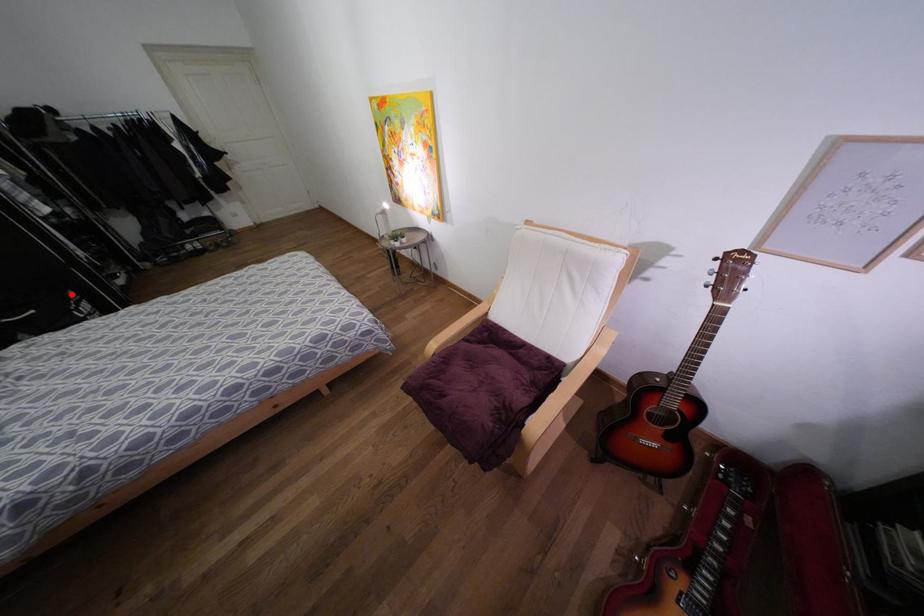
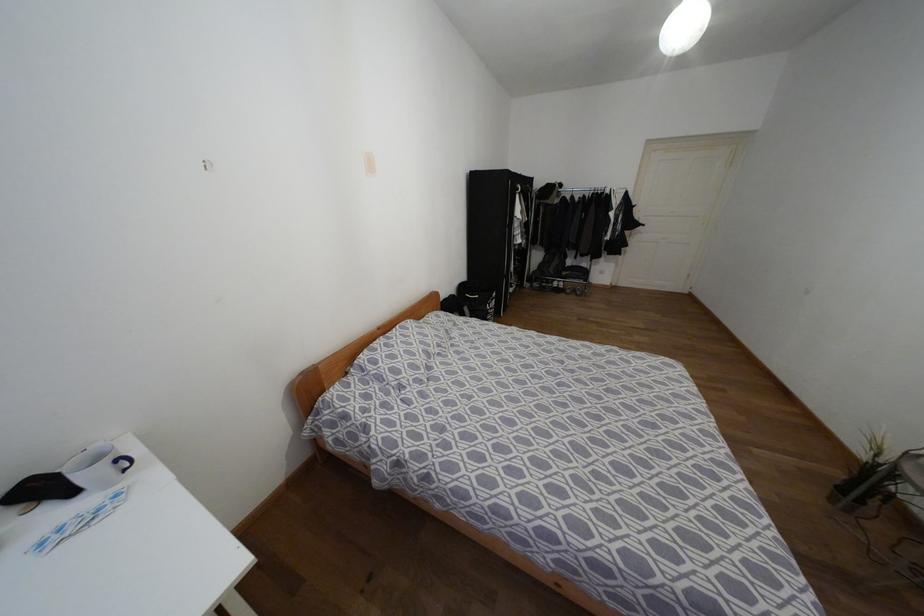
Locate, in the second image, the point that corresponds to the highlighted location in the first image.

(493, 294)